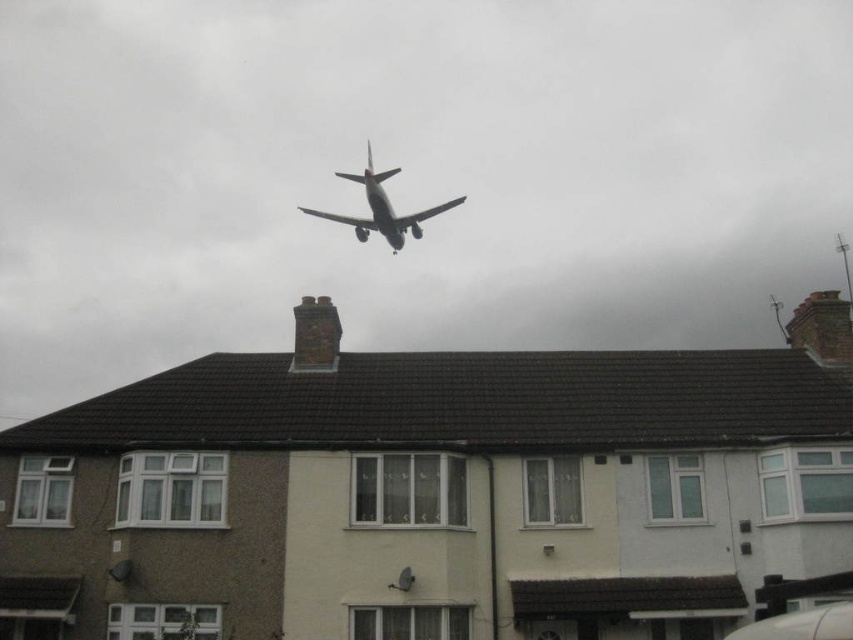
Question: Where is brick chimney at upper right located in relation to silver metallic airplane at center in the image?

Choices:
 (A) below
 (B) above

Answer: (A)

Question: Which point is farther to the camera?

Choices:
 (A) brick chimney at center
 (B) brick chimney at upper right
 (C) silver metallic airplane at center

Answer: (C)

Question: Can you confirm if brick chimney at upper right is bigger than silver metallic airplane at center?

Choices:
 (A) yes
 (B) no

Answer: (B)

Question: Among these points, which one is farthest from the camera?

Choices:
 (A) (813, 320)
 (B) (297, 328)

Answer: (A)

Question: Does brick chimney at upper right appear over brick chimney at center?

Choices:
 (A) yes
 (B) no

Answer: (B)

Question: Which point appears farthest from the camera in this image?

Choices:
 (A) (410, 221)
 (B) (299, 342)
 (C) (827, 340)

Answer: (A)